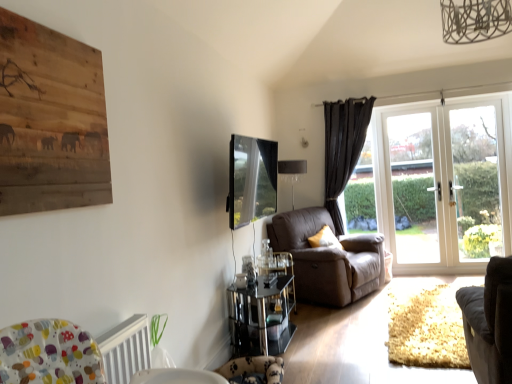
Question: From a real-world perspective, is velvet dark gray armchair at lower right, marked as the first chair in a front-to-back arrangement, on top of wooden painting at upper left?

Choices:
 (A) yes
 (B) no

Answer: (B)

Question: Does velvet dark gray armchair at lower right, which is counted as the 2th chair, starting from the back, appear on the right side of wooden painting at upper left?

Choices:
 (A) yes
 (B) no

Answer: (A)

Question: Is velvet dark gray armchair at lower right, which is counted as the 2th chair, starting from the back, aimed at wooden painting at upper left?

Choices:
 (A) no
 (B) yes

Answer: (A)

Question: Would you say velvet dark gray armchair at lower right, which is counted as the 2th chair, starting from the back, contains wooden painting at upper left?

Choices:
 (A) yes
 (B) no

Answer: (B)

Question: From a real-world perspective, is velvet dark gray armchair at lower right, which is counted as the 2th chair, starting from the back, positioned under wooden painting at upper left based on gravity?

Choices:
 (A) no
 (B) yes

Answer: (B)

Question: From the image's perspective, is black velvet curtain at right positioned above or below yellow fabric pillow at center?

Choices:
 (A) above
 (B) below

Answer: (A)

Question: Would you say black velvet curtain at right is inside or outside yellow fabric pillow at center?

Choices:
 (A) outside
 (B) inside

Answer: (A)

Question: In the image, is black velvet curtain at right positioned in front of or behind yellow fabric pillow at center?

Choices:
 (A) behind
 (B) front

Answer: (A)

Question: Is black velvet curtain at right wider or thinner than yellow fabric pillow at center?

Choices:
 (A) thin
 (B) wide

Answer: (A)

Question: Considering the relative positions of white textured radiator at lower left and clear glass door at right, the 1th screen door viewed from the right, in the image provided, is white textured radiator at lower left to the left or to the right of clear glass door at right, the 1th screen door viewed from the right,?

Choices:
 (A) right
 (B) left

Answer: (B)

Question: Considering the positions of point (98, 337) and point (458, 168), is point (98, 337) closer or farther from the camera than point (458, 168)?

Choices:
 (A) farther
 (B) closer

Answer: (B)

Question: Looking at their shapes, would you say white textured radiator at lower left is wider or thinner than clear glass door at right, the 1th screen door viewed from the right?

Choices:
 (A) thin
 (B) wide

Answer: (B)

Question: In terms of height, does white textured radiator at lower left look taller or shorter compared to clear glass door at right, positioned as the 2th screen door in left-to-right order?

Choices:
 (A) tall
 (B) short

Answer: (B)

Question: Considering the relative positions of brown leather couch at center, which is counted as the 1th chair, starting from the back, and fluffy fabric swivel chair at lower center in the image provided, is brown leather couch at center, which is counted as the 1th chair, starting from the back, to the left or to the right of fluffy fabric swivel chair at lower center?

Choices:
 (A) left
 (B) right

Answer: (B)

Question: Is brown leather couch at center, which appears as the second chair when viewed from the front, bigger or smaller than fluffy fabric swivel chair at lower center?

Choices:
 (A) small
 (B) big

Answer: (B)